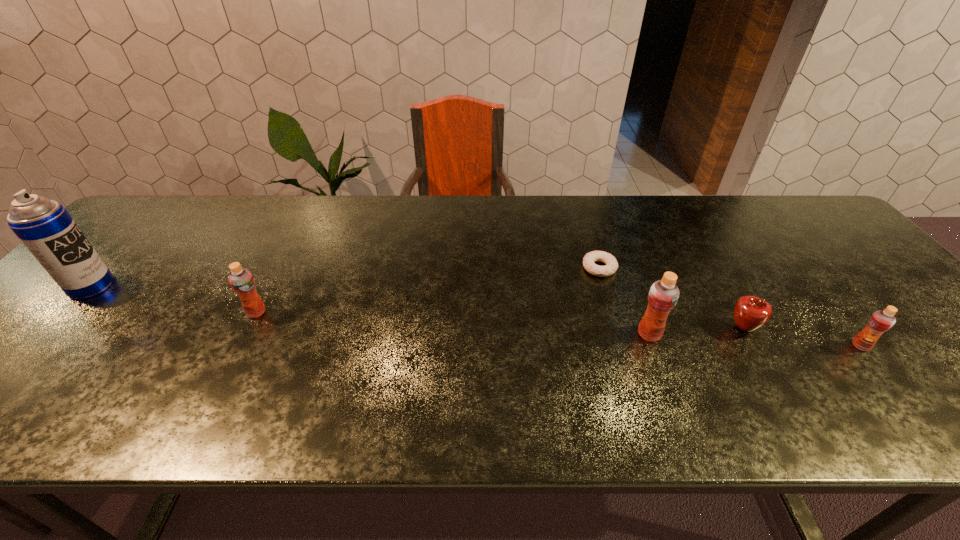
At what (x,y) coordinates should I click in order to perform the action: click on the second tallest orange juice. Please return your answer as a coordinate pair (x, y). Image resolution: width=960 pixels, height=540 pixels. Looking at the image, I should click on (241, 280).

Locate an element on the screen. This screenshot has width=960, height=540. the fifth object from right to left is located at coordinates (241, 280).

This screenshot has height=540, width=960. I want to click on the fifth shortest object, so click(x=663, y=295).

Where is `the tallest orange juice`? The width and height of the screenshot is (960, 540). the tallest orange juice is located at coordinates coord(663,295).

I want to click on the shortest orange juice, so click(880, 321).

Locate an element on the screen. This screenshot has height=540, width=960. the fourth tallest object is located at coordinates (880, 321).

The height and width of the screenshot is (540, 960). I want to click on doughnut, so click(611, 266).

The image size is (960, 540). I want to click on the second object from right to left, so click(x=751, y=313).

I want to click on the fifth tallest object, so click(x=751, y=313).

Where is `aerosol can`? The width and height of the screenshot is (960, 540). aerosol can is located at coordinates (44, 226).